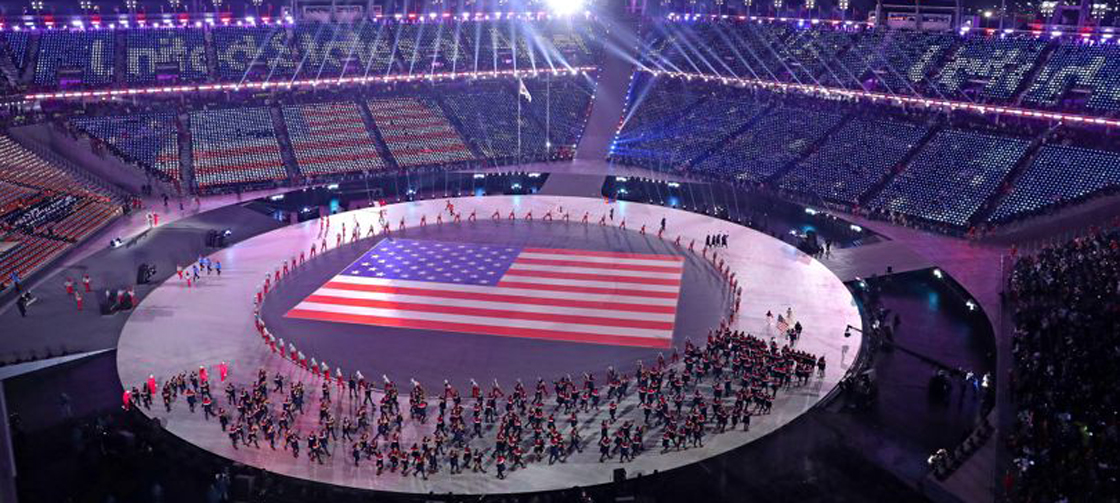
Where is `spotlight beams`? The width and height of the screenshot is (1120, 503). spotlight beams is located at coordinates (252, 60), (492, 36), (437, 37), (536, 38), (618, 29).